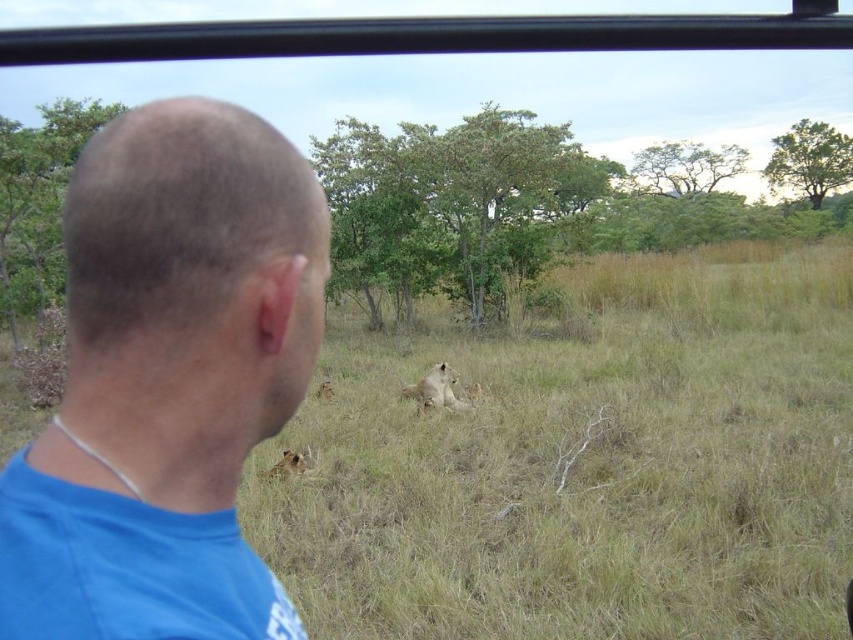
Based on the photo, you are inside a safari vehicle and want to know where the blue fabric shirt at left is located in the image. Please provide its coordinates in the format of a point with two decimal places.

The blue fabric shirt at left is located at point (167, 381).

In the scene shown: You are a safari guide standing inside the safari vehicle. You notice the blue fabric shirt at left and the golden fur lion at center. Which object is wider?

The golden fur lion at center is wider than the blue fabric shirt at left.

You are a safari guide standing inside the safari vehicle. You notice the blue fabric shirt at left and the golden fur lion at lower left. Which object is closer to you?

The blue fabric shirt at left is closer to the viewer than the golden fur lion at lower left.